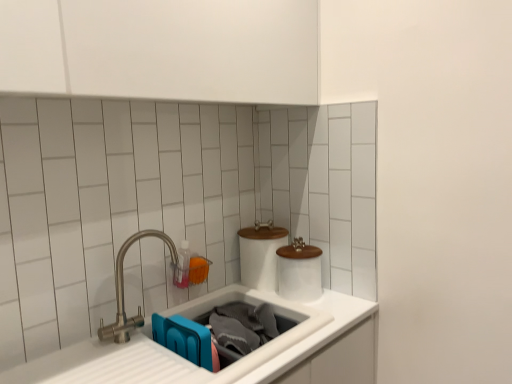
Question: From the image's perspective, does white ceramic toilet paper at center, the second toilet paper positioned from the right, appear higher than white glossy toilet paper at center, placed as the first toilet paper when sorted from right to left?

Choices:
 (A) yes
 (B) no

Answer: (A)

Question: Considering the relative positions of white ceramic toilet paper at center, which is the first toilet paper in left-to-right order, and white glossy toilet paper at center, placed as the first toilet paper when sorted from right to left, in the image provided, is white ceramic toilet paper at center, which is the first toilet paper in left-to-right order, to the right of white glossy toilet paper at center, placed as the first toilet paper when sorted from right to left, from the viewer's perspective?

Choices:
 (A) yes
 (B) no

Answer: (B)

Question: Does white ceramic toilet paper at center, the second toilet paper positioned from the right, contain white glossy toilet paper at center, placed as the first toilet paper when sorted from right to left?

Choices:
 (A) yes
 (B) no

Answer: (B)

Question: Considering the relative positions of white ceramic toilet paper at center, the second toilet paper positioned from the right, and white glossy toilet paper at center, placed as the first toilet paper when sorted from right to left, in the image provided, is white ceramic toilet paper at center, the second toilet paper positioned from the right, behind white glossy toilet paper at center, placed as the first toilet paper when sorted from right to left,?

Choices:
 (A) no
 (B) yes

Answer: (B)

Question: From the image's perspective, would you say white ceramic toilet paper at center, the second toilet paper positioned from the right, is shown under white glossy toilet paper at center, placed as the first toilet paper when sorted from right to left?

Choices:
 (A) yes
 (B) no

Answer: (B)

Question: Is white ceramic toilet paper at center, which is the first toilet paper in left-to-right order, oriented towards white glossy toilet paper at center, placed as the first toilet paper when sorted from right to left?

Choices:
 (A) no
 (B) yes

Answer: (B)

Question: Could you tell me if translucent plastic bottle at sink is turned towards brushed metal faucet at left?

Choices:
 (A) no
 (B) yes

Answer: (A)

Question: Is translucent plastic bottle at sink oriented away from brushed metal faucet at left?

Choices:
 (A) yes
 (B) no

Answer: (B)

Question: Can you confirm if translucent plastic bottle at sink is shorter than brushed metal faucet at left?

Choices:
 (A) yes
 (B) no

Answer: (A)

Question: Considering the relative sizes of translucent plastic bottle at sink and brushed metal faucet at left in the image provided, is translucent plastic bottle at sink smaller than brushed metal faucet at left?

Choices:
 (A) yes
 (B) no

Answer: (A)

Question: Is translucent plastic bottle at sink beside brushed metal faucet at left?

Choices:
 (A) no
 (B) yes

Answer: (A)

Question: Considering the relative sizes of translucent plastic bottle at sink and brushed metal faucet at left in the image provided, is translucent plastic bottle at sink taller than brushed metal faucet at left?

Choices:
 (A) yes
 (B) no

Answer: (B)

Question: From a real-world perspective, is brushed metal faucet at left physically below white matte sink at lower center, the second sink positioned from the left?

Choices:
 (A) yes
 (B) no

Answer: (B)